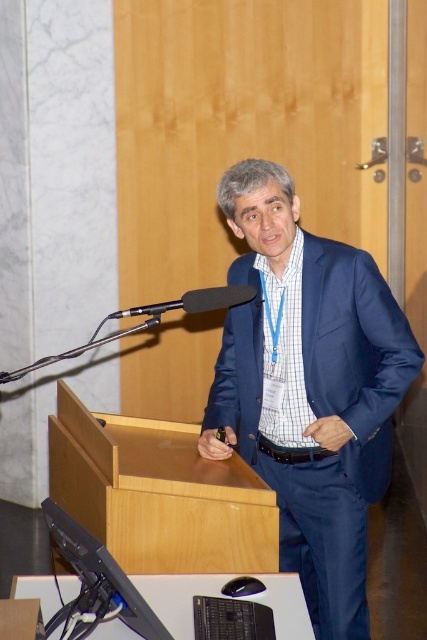
You are an event planner setting up a stage for a speaker. You need to ensure the speaker can reach both the blue satin suit at center and the black matte microphone at center comfortably. Based on their positions, which object is closer to the speaker?

The blue satin suit at center is positioned on the right side of the black matte microphone at center, so the speaker would find the black matte microphone at center closer to their speaking position since it is on the left side of the podium where the microphone is placed.

You are an event organizer setting up a photo shoot for a speaker. You need to ensure the blue satin suit at center and the black matte microphone at center are visible in the frame. Which object should be placed closer to the camera to ensure both are visible?

The blue satin suit at center should be placed closer to the camera since the black matte microphone at center is behind it. This way, both objects will be visible in the frame without one blocking the other.

You are sitting in the audience facing the speaker. There are two points marked on the podium. One is at coordinate point [263,470] and the other is at point [196,289]. Which point is closer to you?

Point [196,289] is closer to you because it is less further away than point [263,470].